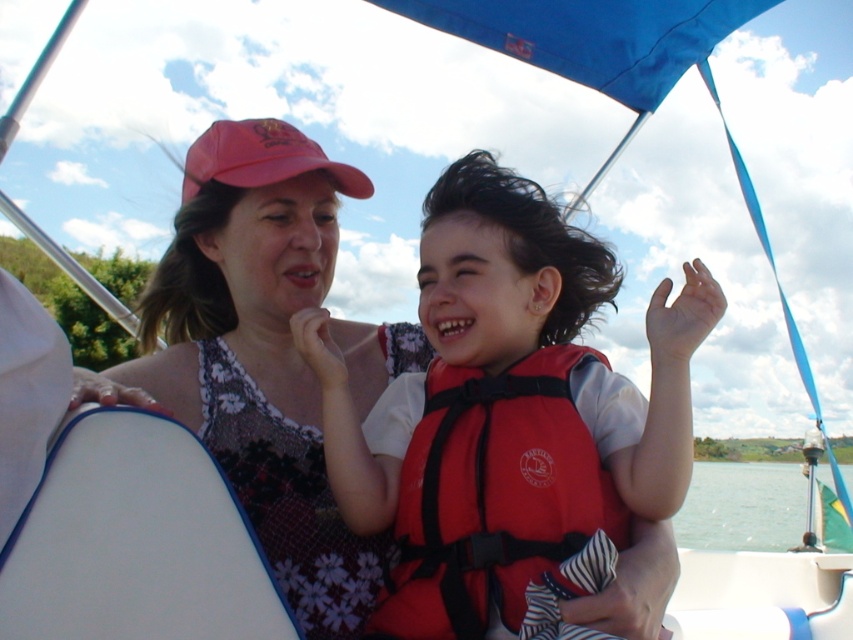
You are a photographer trying to capture a candid shot of the two people on the boat. You notice both the matte pink cap at upper center and the red matte baseball cap at upper center. Which cap is positioned lower on the image?

The matte pink cap at upper center is positioned below the red matte baseball cap at upper center, so the matte pink cap at upper center is lower in the image.

You are on a boat and need to choose between the red matte life vest at center and the red fabric life jacket at center. Which one is located to the left?

The red matte life vest at center is positioned on the left side of the red fabric life jacket at center, so it is the one on the left.

You are a photographer trying to capture the red matte life vest at center in your shot. Given the coordinates provided, can you estimate whether the vest is positioned closer to the center of the image or near the edges?

The coordinates of the red matte life vest at center are at point (506, 410), which places it closer to the center of the image rather than near the edges.